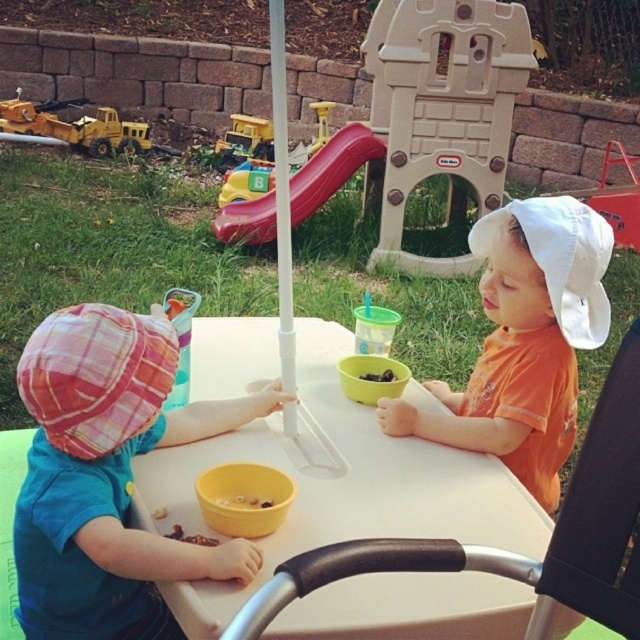
Question: Estimate the real-world distances between objects in this image. Which object is closer to the yellow plastic toy truck at left?

Choices:
 (A) dark chocolate chips at center
 (B) metallic yellow toy truck at upper left

Answer: (B)

Question: Is plaid fabric hat at left bigger than rubberized plastic slide at center?

Choices:
 (A) no
 (B) yes

Answer: (A)

Question: Is rubberized plastic slide at center wider than brown crumbly food at center?

Choices:
 (A) no
 (B) yes

Answer: (B)

Question: Which point is closer to the camera taking this photo?

Choices:
 (A) (81, 100)
 (B) (156, 540)
 (C) (376, 376)

Answer: (B)

Question: Which is nearer to the white plastic table at center?

Choices:
 (A) white cotton hat at upper right
 (B) dark chocolate chips at center

Answer: (A)

Question: Can you confirm if plaid fabric hat at left is positioned above metallic yellow toy truck at upper left?

Choices:
 (A) yes
 (B) no

Answer: (B)